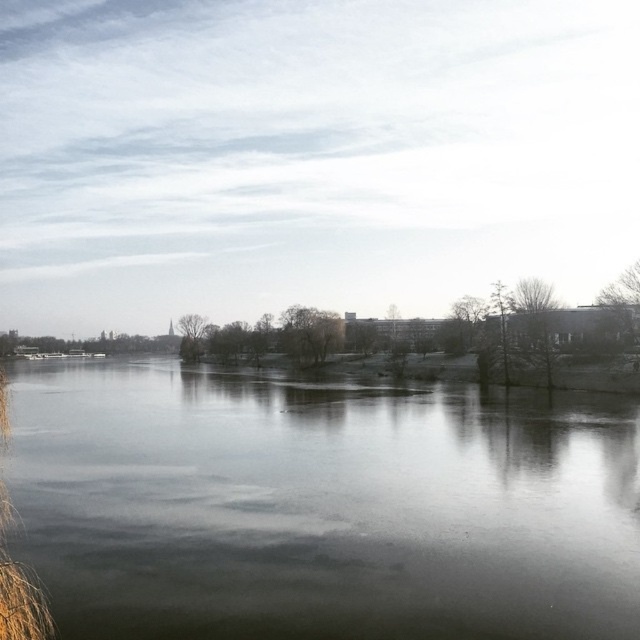
Question: Which point is farther from the camera taking this photo?

Choices:
 (A) (200, 444)
 (B) (45, 625)

Answer: (A)

Question: Which object appears closest to the camera in this image?

Choices:
 (A) brown grass at left
 (B) dark reflective water at center

Answer: (A)

Question: Is dark reflective water at center to the right of brown grass at left from the viewer's perspective?

Choices:
 (A) no
 (B) yes

Answer: (B)

Question: Which point is closer to the camera?

Choices:
 (A) (140, 449)
 (B) (20, 637)

Answer: (B)

Question: Does dark reflective water at center appear on the left side of brown grass at left?

Choices:
 (A) yes
 (B) no

Answer: (B)

Question: Does dark reflective water at center have a greater width compared to brown grass at left?

Choices:
 (A) yes
 (B) no

Answer: (A)